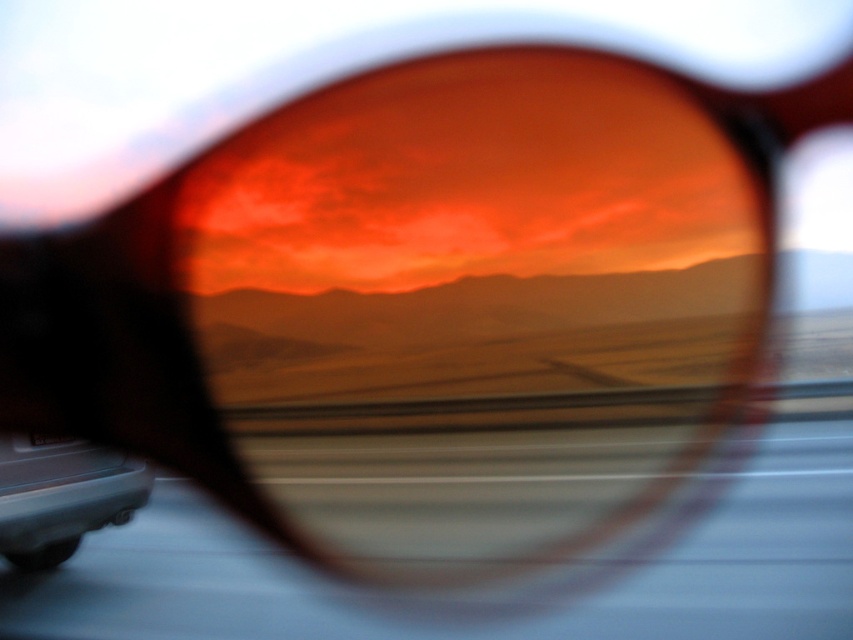
You are driving a car and want to check your rearview mirror to see if there is a vehicle behind you. Given the image, can you see the matte gray car at lower left in the reflection of the matte orange lens at center?

The matte orange lens at center is above the matte gray car at lower left, so the matte gray car at lower left would be visible in the reflection of the matte orange lens at center.

You are driving a car and want to check the reflection in your sunglasses. Based on the scene, can you tell if the matte gray car at lower left is visible in the reflection of the matte orange lens at center?

The matte gray car at lower left is behind the matte orange lens at center, so it would not be visible in the reflection since it is positioned behind the lens.

You are driving a matte gray car at lower left and want to take a photo of the sunset through the matte orange lens at center. Can you position your car so that the lens is to the right of your car in the photo?

Yes, since the matte orange lens at center is already positioned to the right of the matte gray car at lower left, you can take the photo as described.